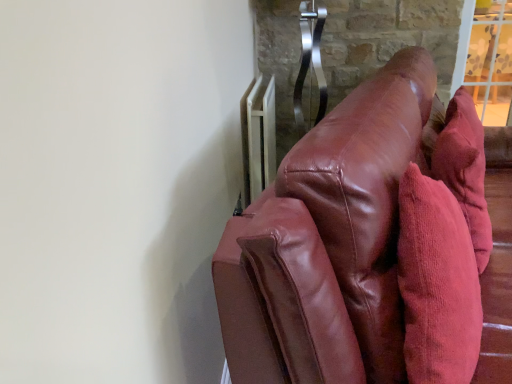
Question: Is white metallic radiator at upper right wider than corduroy throw pillow at right?

Choices:
 (A) yes
 (B) no

Answer: (B)

Question: Is white metallic radiator at upper right outside of corduroy throw pillow at right?

Choices:
 (A) yes
 (B) no

Answer: (A)

Question: Is white metallic radiator at upper right shorter than corduroy throw pillow at right?

Choices:
 (A) yes
 (B) no

Answer: (A)

Question: Is white metallic radiator at upper right to the left of corduroy throw pillow at right from the viewer's perspective?

Choices:
 (A) yes
 (B) no

Answer: (A)

Question: Is white metallic radiator at upper right further to camera compared to corduroy throw pillow at right?

Choices:
 (A) yes
 (B) no

Answer: (A)

Question: Considering the relative positions of corduroy throw pillow at right and shiny brown leather couch at right in the image provided, is corduroy throw pillow at right to the left or to the right of shiny brown leather couch at right?

Choices:
 (A) right
 (B) left

Answer: (A)

Question: Is corduroy throw pillow at right taller or shorter than shiny brown leather couch at right?

Choices:
 (A) short
 (B) tall

Answer: (A)

Question: Do you think corduroy throw pillow at right is within shiny brown leather couch at right, or outside of it?

Choices:
 (A) inside
 (B) outside

Answer: (A)

Question: From a real-world perspective, is corduroy throw pillow at right above or below shiny brown leather couch at right?

Choices:
 (A) above
 (B) below

Answer: (A)

Question: Considering the positions of shiny brown leather couch at right and white metallic radiator at upper right in the image, is shiny brown leather couch at right bigger or smaller than white metallic radiator at upper right?

Choices:
 (A) big
 (B) small

Answer: (A)

Question: Is shiny brown leather couch at right taller or shorter than white metallic radiator at upper right?

Choices:
 (A) tall
 (B) short

Answer: (A)

Question: Considering the positions of shiny brown leather couch at right and white metallic radiator at upper right in the image, is shiny brown leather couch at right wider or thinner than white metallic radiator at upper right?

Choices:
 (A) wide
 (B) thin

Answer: (A)

Question: In the image, is shiny brown leather couch at right positioned in front of or behind white metallic radiator at upper right?

Choices:
 (A) behind
 (B) front

Answer: (B)

Question: Is white metallic radiator at upper right wider or thinner than shiny brown leather couch at right?

Choices:
 (A) wide
 (B) thin

Answer: (B)

Question: Is white metallic radiator at upper right bigger or smaller than shiny brown leather couch at right?

Choices:
 (A) big
 (B) small

Answer: (B)